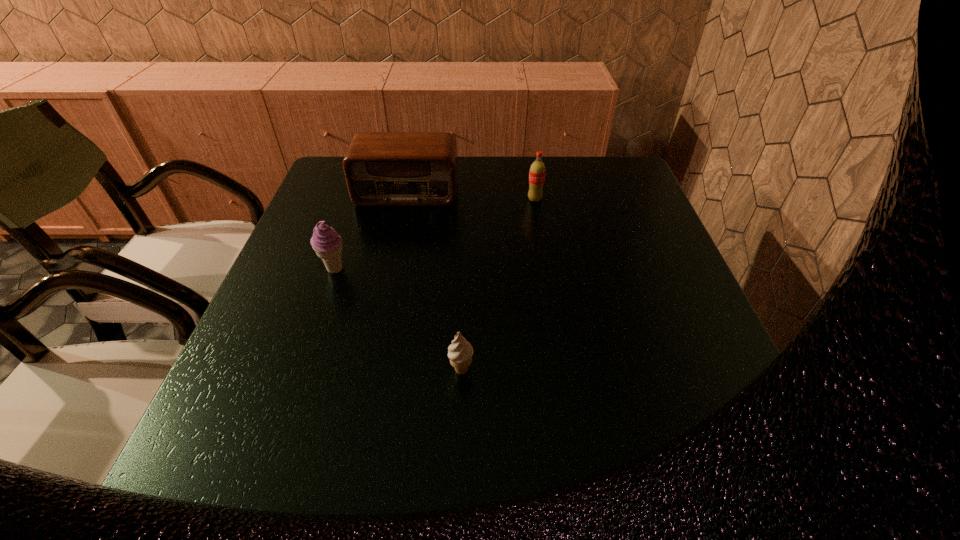
Locate an element on the screen. radio receiver at the far edge is located at coordinates (381, 168).

Identify the location of soda positioned at the far edge. (537, 171).

I want to click on radio receiver that is at the left edge, so click(381, 168).

The height and width of the screenshot is (540, 960). Find the location of `icecream at the left edge`. icecream at the left edge is located at coordinates (326, 242).

Locate an element on the screen. object that is at the far left corner is located at coordinates (381, 168).

Where is `vacant space at the near edge of the desktop`? vacant space at the near edge of the desktop is located at coordinates (405, 486).

This screenshot has width=960, height=540. I want to click on free space at the left edge, so click(x=308, y=289).

I want to click on vacant space at the right edge of the desktop, so [637, 290].

In the image, there is a desktop. Where is `vacant area at the far left corner`? This screenshot has height=540, width=960. vacant area at the far left corner is located at coordinates (343, 178).

Where is `vacant area at the near left corner`? This screenshot has width=960, height=540. vacant area at the near left corner is located at coordinates (256, 502).